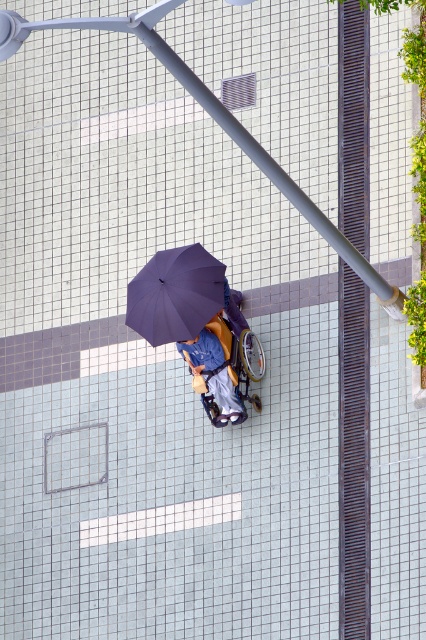
Question: Can you confirm if purple matte umbrella at center is positioned to the right of blue fabric umbrella at center?

Choices:
 (A) yes
 (B) no

Answer: (B)

Question: Among these points, which one is nearest to the camera?

Choices:
 (A) (212, 376)
 (B) (150, 330)

Answer: (B)

Question: Is purple matte umbrella at center thinner than blue fabric umbrella at center?

Choices:
 (A) yes
 (B) no

Answer: (B)

Question: Which object is closer to the camera taking this photo?

Choices:
 (A) purple matte umbrella at center
 (B) blue fabric umbrella at center

Answer: (A)

Question: In this image, where is purple matte umbrella at center located relative to blue fabric umbrella at center?

Choices:
 (A) below
 (B) above

Answer: (B)